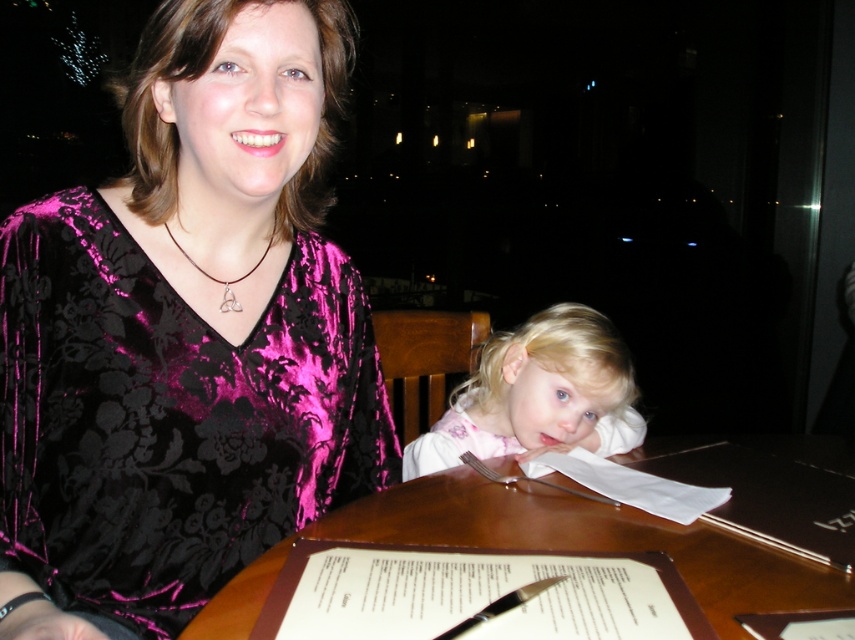
Question: Which point appears closest to the camera in this image?

Choices:
 (A) (559, 602)
 (B) (260, 257)
 (C) (621, 442)

Answer: (A)

Question: Is matte pink shirt at center thinner than gold metallic pendant at center?

Choices:
 (A) yes
 (B) no

Answer: (B)

Question: Where is matte pink shirt at center located in relation to gold metallic pendant at center in the image?

Choices:
 (A) left
 (B) right

Answer: (B)

Question: In this image, where is wooden table at center located relative to white paper menu at center?

Choices:
 (A) left
 (B) right

Answer: (B)

Question: Which point is farther from the camera taking this photo?

Choices:
 (A) (853, 579)
 (B) (315, 586)

Answer: (A)

Question: Which of the following is the closest to the observer?

Choices:
 (A) (569, 602)
 (B) (124, 205)
 (C) (225, 300)

Answer: (A)